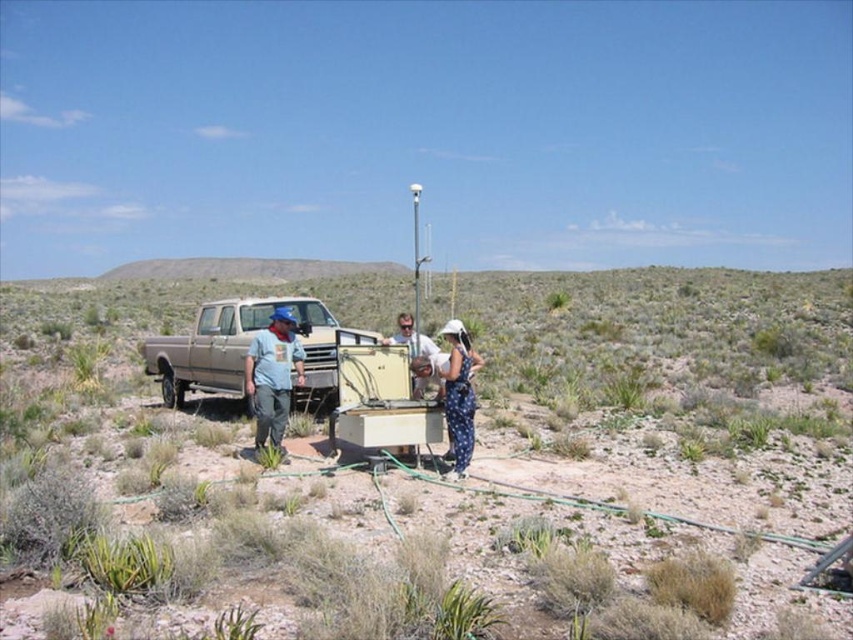
You are a photographer trying to capture a group photo of the matte blue shirt at center and the matte white shirt at center. Since you want to highlight both individuals equally, which person should you position closer to the camera to compensate for their size difference?

The matte blue shirt at center occupies less space than the matte white shirt at center, so you should position the matte blue shirt at center closer to the camera to balance their sizes in the photo.

Consider the image. You are a photographer trying to capture a group photo of the matte blue shirt at center and the blue dotted dress at center. Since you want to ensure both subjects are fully visible in the frame, which subject should you position closer to the camera to avoid cropping?

The matte blue shirt at center has a larger width than the blue dotted dress at center. To ensure both are fully visible, position the matte blue shirt at center closer to the camera so its wider frame can fit without cropping.

You are a hiker who wants to take a photo of the brown matte truck at center and the matte blue shirt at center from a position where both are visible. Based on their positions, which object should you place closer to the camera to ensure both are in the frame?

The brown matte truck at center is located above the matte blue shirt at center. To ensure both are visible in the frame, you should position the camera closer to the matte blue shirt at center so that the truck at center can be seen above it without being cropped out.